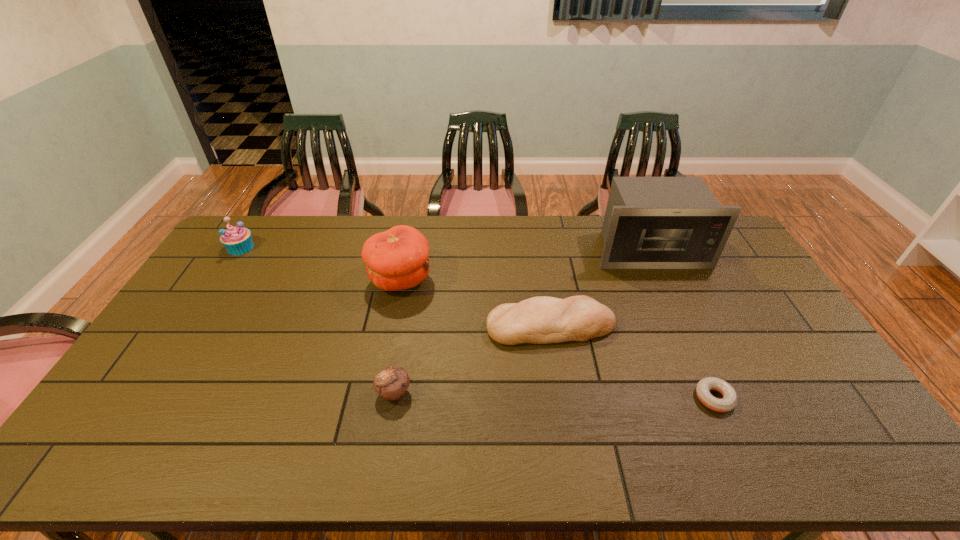
Where is `free spot located on the front of the fifth shortest object`? This screenshot has height=540, width=960. free spot located on the front of the fifth shortest object is located at coordinates (389, 339).

Locate an element on the screen. This screenshot has height=540, width=960. vacant space located on the front of the left muffin is located at coordinates (187, 330).

The width and height of the screenshot is (960, 540). Find the location of `vacant area situated 0.400m on the back of the third nearest object`. vacant area situated 0.400m on the back of the third nearest object is located at coordinates (536, 233).

Where is `free space located 0.150m on the front of the nearer muffin`? The image size is (960, 540). free space located 0.150m on the front of the nearer muffin is located at coordinates (382, 463).

I want to click on vacant region located on the front of the shortest object, so point(731,434).

This screenshot has width=960, height=540. I want to click on microwave oven that is at the far edge, so point(650,222).

This screenshot has height=540, width=960. In order to click on muffin that is at the far edge in this screenshot , I will do `click(237, 240)`.

You are a GUI agent. You are given a task and a screenshot of the screen. Output one action in this format:
    pyautogui.click(x=<x>, y=<y>)
    Task: Click on the object that is at the left edge
    The image size is (960, 540).
    Given the screenshot: What is the action you would take?
    pyautogui.click(x=237, y=240)

The image size is (960, 540). I want to click on object that is at the right edge, so [x=650, y=222].

The width and height of the screenshot is (960, 540). In order to click on object that is positioned at the far left corner in this screenshot , I will do `click(237, 240)`.